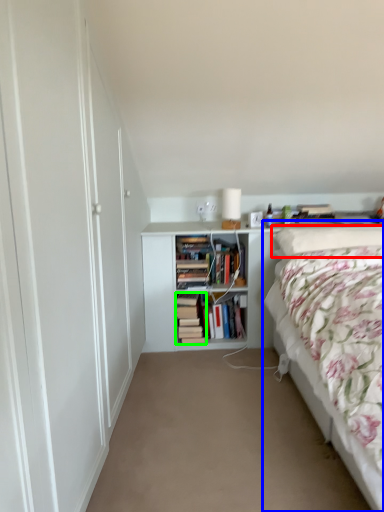
Question: Considering the real-world distances, which object is closest to pillow (highlighted by a red box)? bed (highlighted by a blue box) or book (highlighted by a green box).

Choices:
 (A) bed
 (B) book

Answer: (A)